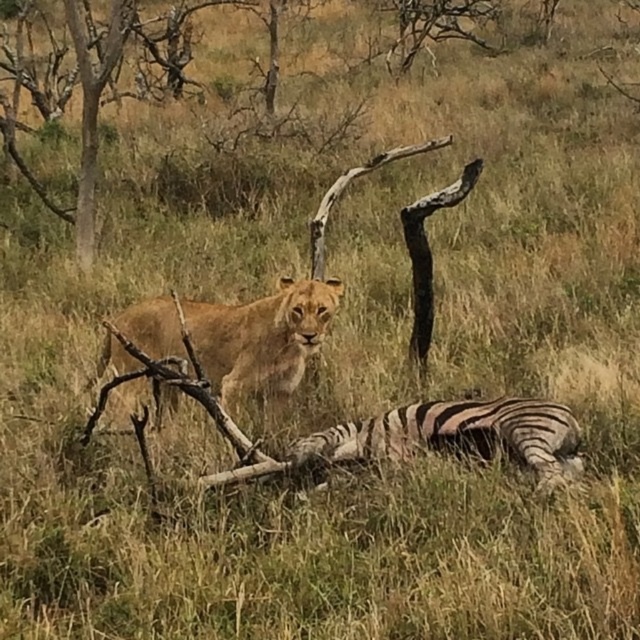
Question: Does golden fur lion at center have a greater width compared to black and white striped zebra at lower center?

Choices:
 (A) no
 (B) yes

Answer: (B)

Question: Is golden fur lion at center behind black and white striped zebra at lower center?

Choices:
 (A) no
 (B) yes

Answer: (B)

Question: Considering the relative positions of golden fur lion at center and black and white striped zebra at lower center in the image provided, where is golden fur lion at center located with respect to black and white striped zebra at lower center?

Choices:
 (A) left
 (B) right

Answer: (A)

Question: Which point appears closest to the camera in this image?

Choices:
 (A) (272, 352)
 (B) (461, 452)

Answer: (B)

Question: Which object appears closest to the camera in this image?

Choices:
 (A) black and white striped zebra at lower center
 (B) golden fur lion at center

Answer: (A)